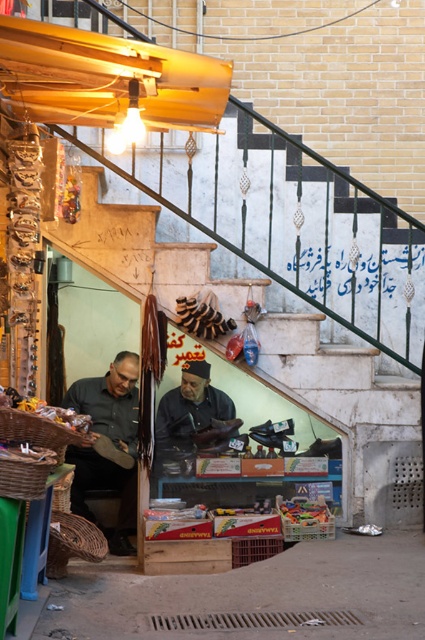
Question: Does dark brown leather cap at center appear over metallic silver sign at center?

Choices:
 (A) no
 (B) yes

Answer: (A)

Question: Which object is the closest to the metallic silver sign at center?

Choices:
 (A) dark brown leather cap at center
 (B) dark gray shirt at center

Answer: (A)

Question: Which of the following is the farthest from the observer?

Choices:
 (A) (346, 284)
 (B) (96, 406)
 (C) (212, 396)

Answer: (B)

Question: Where is dark gray shirt at center located in relation to dark brown leather cap at center in the image?

Choices:
 (A) below
 (B) above

Answer: (A)

Question: Which point is farther to the camera?

Choices:
 (A) metallic silver sign at center
 (B) dark gray shirt at center

Answer: (A)

Question: Is dark brown leather cap at center positioned in front of metallic silver sign at center?

Choices:
 (A) no
 (B) yes

Answer: (B)